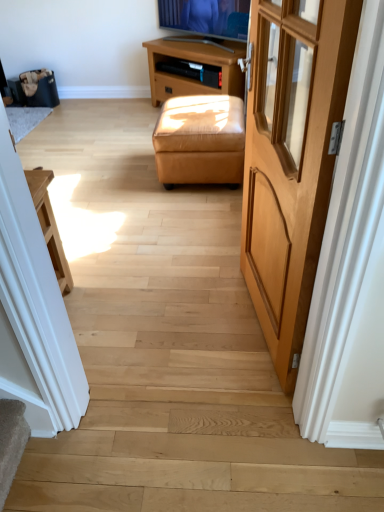
Question: In the image, is brown wooden tv stand at upper center positioned in front of or behind light brown wood door at right?

Choices:
 (A) front
 (B) behind

Answer: (B)

Question: Based on their sizes in the image, would you say brown wooden tv stand at upper center is bigger or smaller than light brown wood door at right?

Choices:
 (A) small
 (B) big

Answer: (B)

Question: Estimate the real-world distances between objects in this image. Which object is closer to the tan leather ottoman at center?

Choices:
 (A) light brown wood door at right
 (B) brown wooden tv stand at upper center

Answer: (B)

Question: Which of these objects is positioned closest to the brown wooden tv stand at upper center?

Choices:
 (A) light brown wood door at right
 (B) tan leather ottoman at center

Answer: (B)